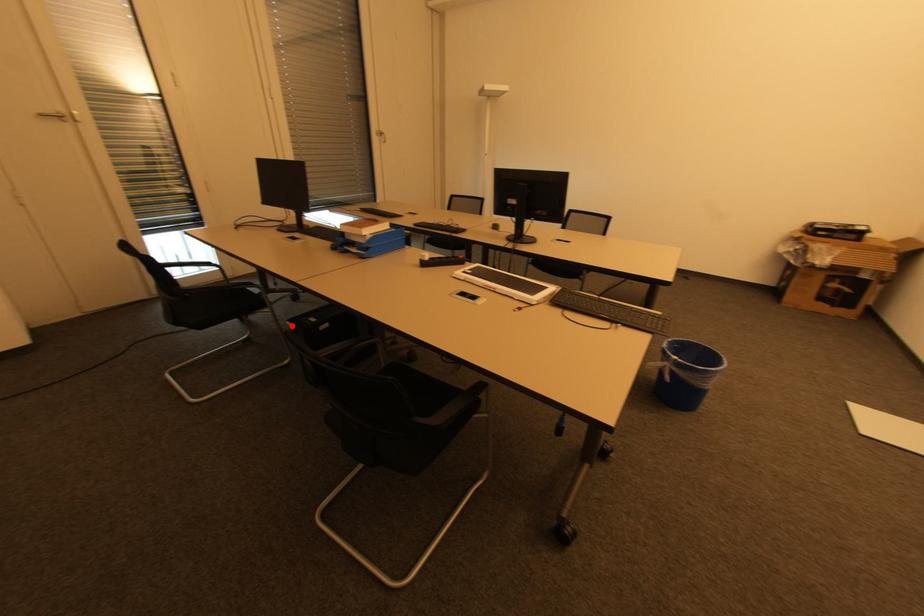
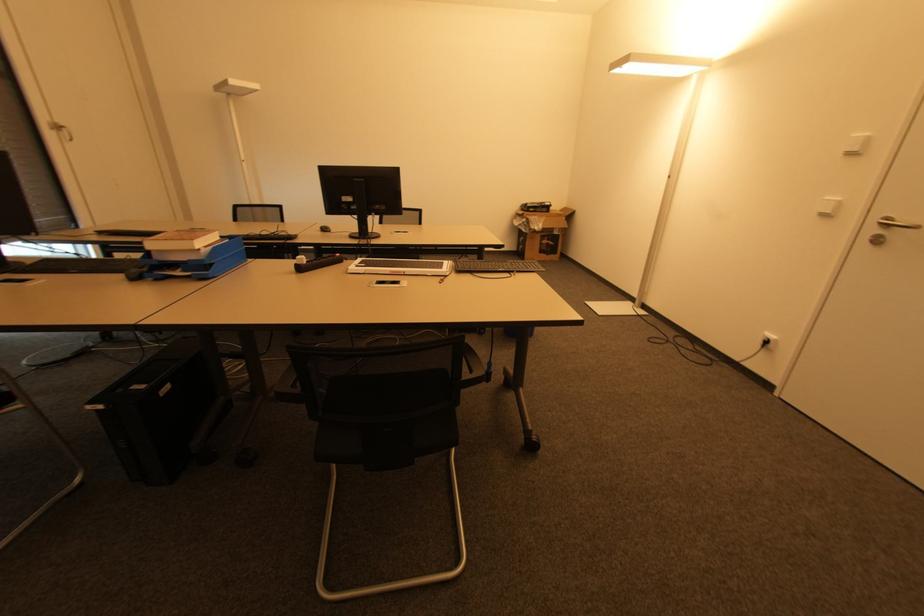
Find the pixel in the second image that matches the highlighted location in the first image.

(101, 408)